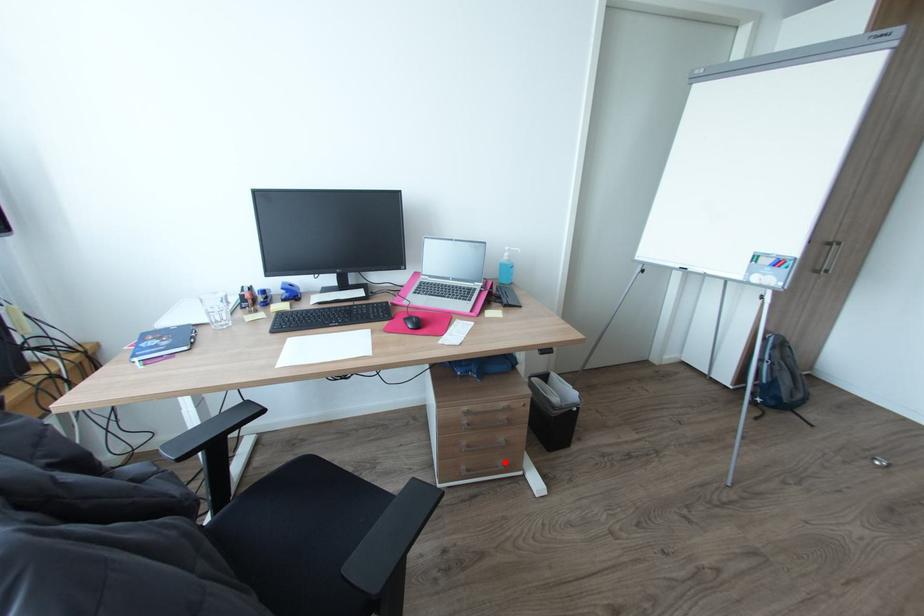
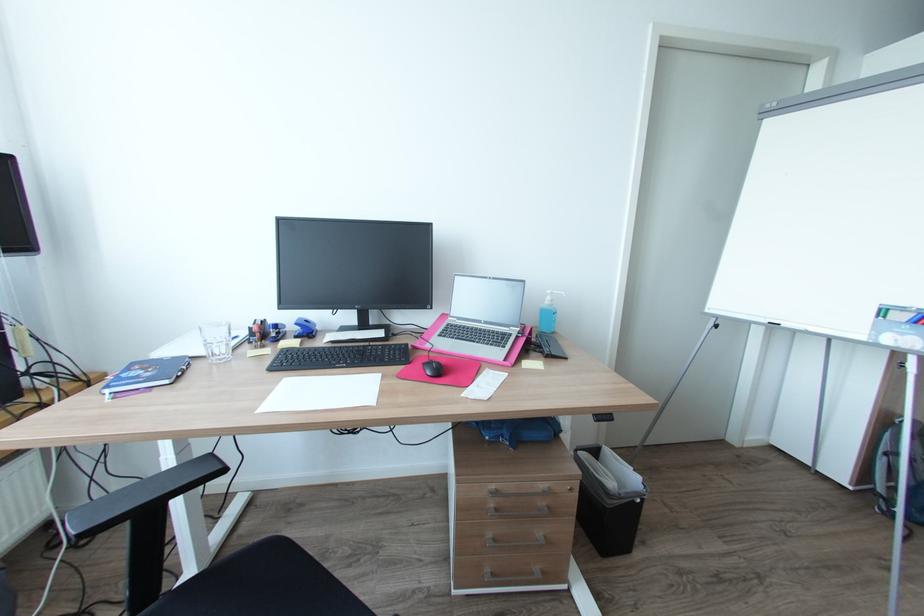
Question: I am providing you with two images of the same scene from different viewpoints. Given a red point in image1, look at the same physical point in image2. Is it:

Choices:
 (A) Closer to the viewpoint
 (B) Farther from the viewpoint

Answer: (A)